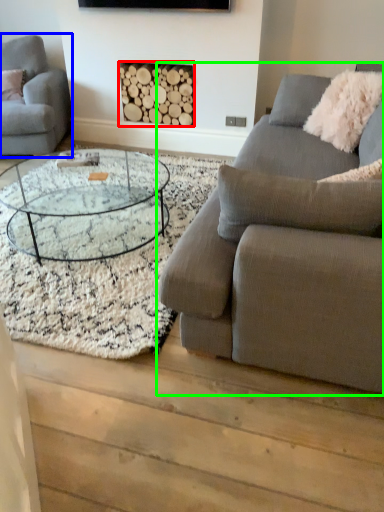
Question: Which is nearer to the fireplace (highlighted by a red box)? studio couch (highlighted by a blue box) or studio couch (highlighted by a green box).

Choices:
 (A) studio couch
 (B) studio couch

Answer: (A)